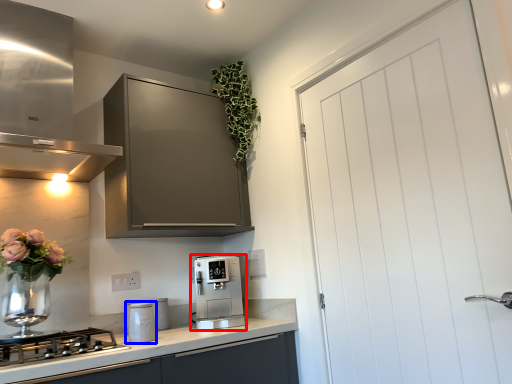
Question: Among these objects, which one is farthest to the camera, kitchen appliance (highlighted by a red box) or kitchen appliance (highlighted by a blue box)?

Choices:
 (A) kitchen appliance
 (B) kitchen appliance

Answer: (A)